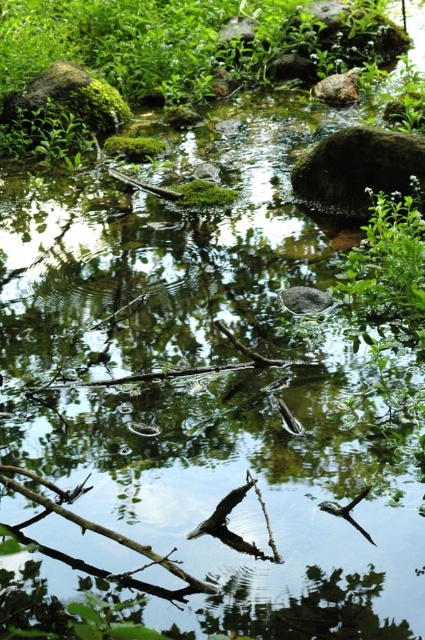
You are a frog trying to jump from the green mossy rock at upper left to the green mossy rock at upper right. Based on their sizes, which rock will give you more jumping space to land safely?

The green mossy rock at upper left is larger than the green mossy rock at upper right, so it provides more jumping space for the frog to land safely.

You are standing at the edge of the stream and see a point marked at coordinates (x=387, y=260). What is located at that point?

The point at coordinates (x=387, y=260) marks a green leafy plant at upper right.

You are a hiker who wants to take a photo of both the green leafy plant at upper right and the green mossy rock at upper left. Which object should you move closer to in order to capture both in the same frame?

Since the green leafy plant at upper right is much taller than the green mossy rock at upper left, you should move closer to the green mossy rock at upper left to include both in the same frame.